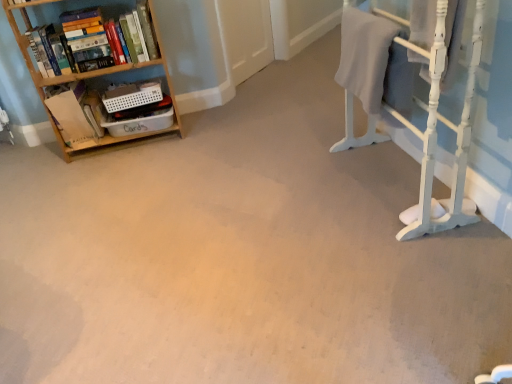
This screenshot has height=384, width=512. Find the location of `free spot to the right of wooden bookshelf at left`. free spot to the right of wooden bookshelf at left is located at coordinates (209, 136).